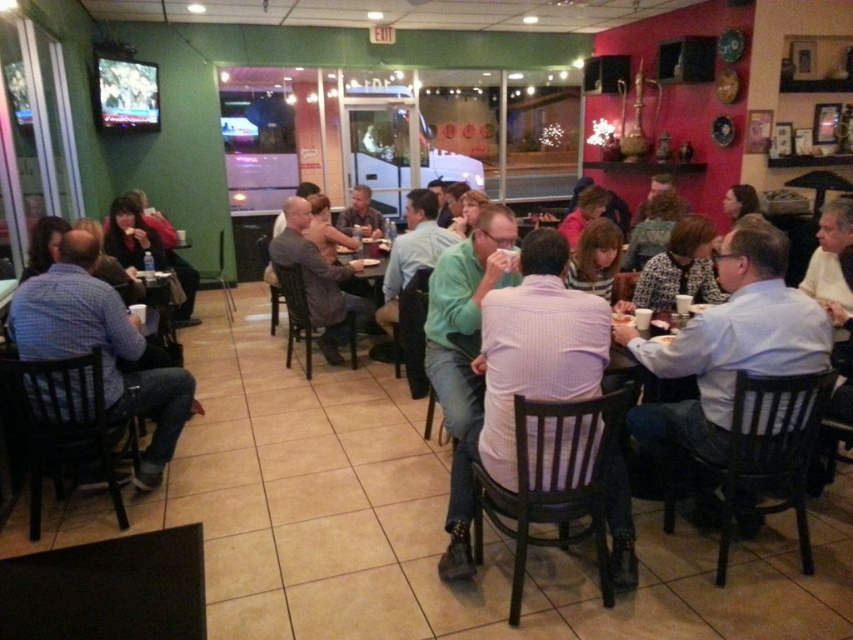
Question: Considering the relative positions of blue plaid shirt at left and light brown shirt at center in the image provided, where is blue plaid shirt at left located with respect to light brown shirt at center?

Choices:
 (A) above
 (B) below

Answer: (B)

Question: Which object is closer to the camera taking this photo?

Choices:
 (A) blue plaid shirt at left
 (B) light brown shirt at center
 (C) white shirt at center

Answer: (C)

Question: Is gray fabric jacket at center thinner than light brown shirt at center?

Choices:
 (A) no
 (B) yes

Answer: (A)

Question: Can you confirm if blue plaid shirt at left is bigger than gray fabric jacket at center?

Choices:
 (A) no
 (B) yes

Answer: (B)

Question: Which object is positioned closest to the blue plaid shirt at left?

Choices:
 (A) white shirt at center
 (B) gray fabric jacket at center
 (C) light brown shirt at center

Answer: (B)

Question: Which object appears closest to the camera in this image?

Choices:
 (A) blue plaid shirt at left
 (B) gray fabric jacket at center
 (C) light brown shirt at center

Answer: (A)